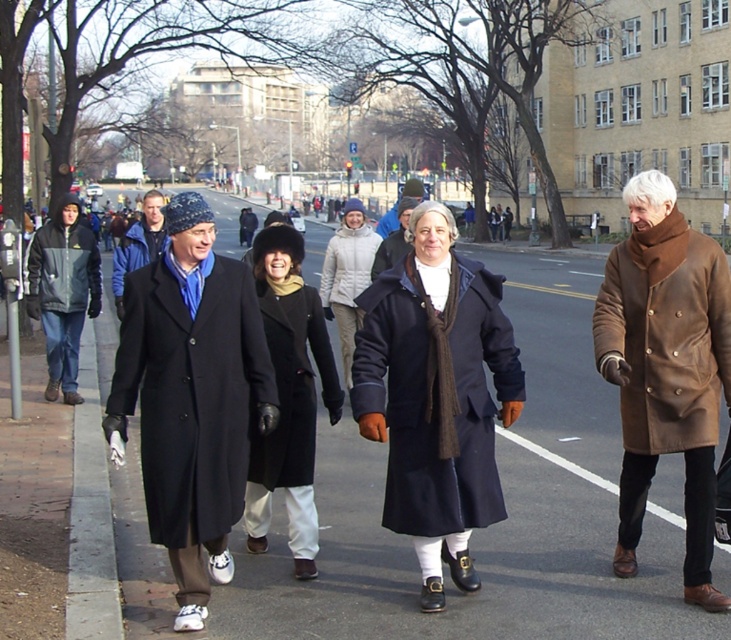
You are a tailor who needs to determine which coat requires more fabric for alterations. Based on the image, which coat would need more fabric, the brown leather coat at right or the blue wool coat at center?

The blue wool coat at center requires more fabric for alterations because its width is greater than the brown leather coat at right.

You are a fashion designer observing people on a chilly city street. You notice the navy wool coat at center and the gray fleece jacket at left. Which clothing item has a greater height measurement?

The navy wool coat at center is taller than the gray fleece jacket at left.

You are a pedestrian standing on the gray asphalt at center and want to walk towards the matte black coat at left. Is the path clear?

The gray asphalt at center is in front of matte black coat at left, so the path is clear for you to walk towards the matte black coat at left.